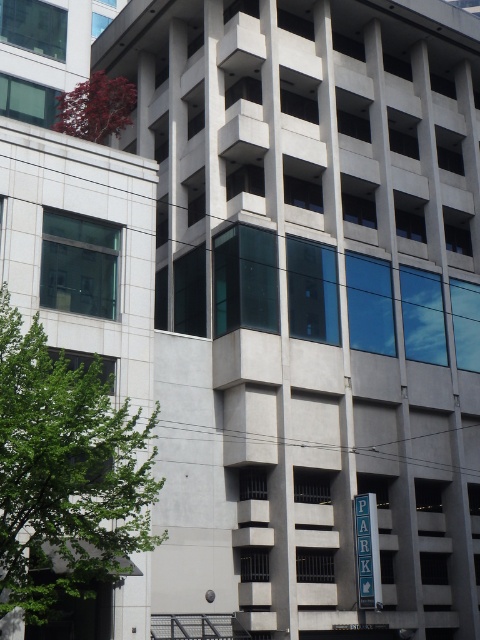
Who is positioned more to the right, red matte tree at upper left or blue metal parking sign at center?

blue metal parking sign at center is more to the right.

Who is shorter, red matte tree at upper left or blue metal parking sign at center?

red matte tree at upper left is shorter.

Image resolution: width=480 pixels, height=640 pixels. I want to click on red matte tree at upper left, so (x=96, y=108).

The width and height of the screenshot is (480, 640). In order to click on green leafy tree at left in this screenshot , I will do `click(66, 474)`.

Between green leafy tree at left and red matte tree at upper left, which one has more height?

Standing taller between the two is green leafy tree at left.

Locate an element on the screen. green leafy tree at left is located at coordinates [x=66, y=474].

Where is `green leafy tree at left`? green leafy tree at left is located at coordinates (66, 474).

Is green leafy tree at left to the right of blue metal parking sign at center from the viewer's perspective?

No, green leafy tree at left is not to the right of blue metal parking sign at center.

Which of these two, green leafy tree at left or blue metal parking sign at center, stands shorter?

blue metal parking sign at center is shorter.

Between point (85, 408) and point (372, 579), which one is positioned in front?

Point (85, 408)

This screenshot has height=640, width=480. Identify the location of green leafy tree at left. (66, 474).